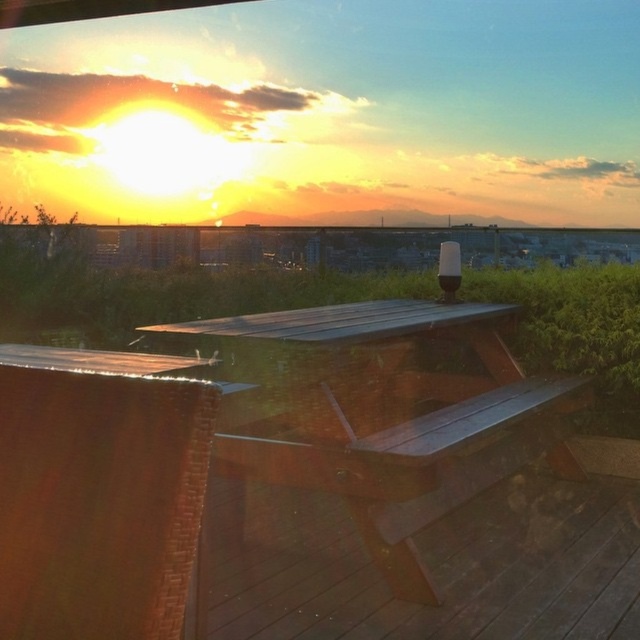
You are standing on the rooftop and want to place a new potted plant on the brown wooden deck at center. However, there is already a smooth wood table at center there. Can the plant be placed on the deck without moving the table?

The brown wooden deck at center is positioned under smooth wood table at center, so the deck is underneath the table. This means the deck is not accessible for placing the plant without moving the table.

You are standing on the rooftop and want to place a new bench exactly at the center of the brown wooden deck at center. According to the coordinates provided, where should you place the bench?

The bench should be placed at the coordinates (417, 561) since that is the 2D location of the brown wooden deck at center.

You are planning to place a decorative vase on the smooth wood table at center and the dark brown wood picnic table at center. Since both tables are at the center, which table can hold the vase more securely based on their thickness?

The dark brown wood picnic table at center is thicker than the smooth wood table at center, so it can hold the vase more securely.